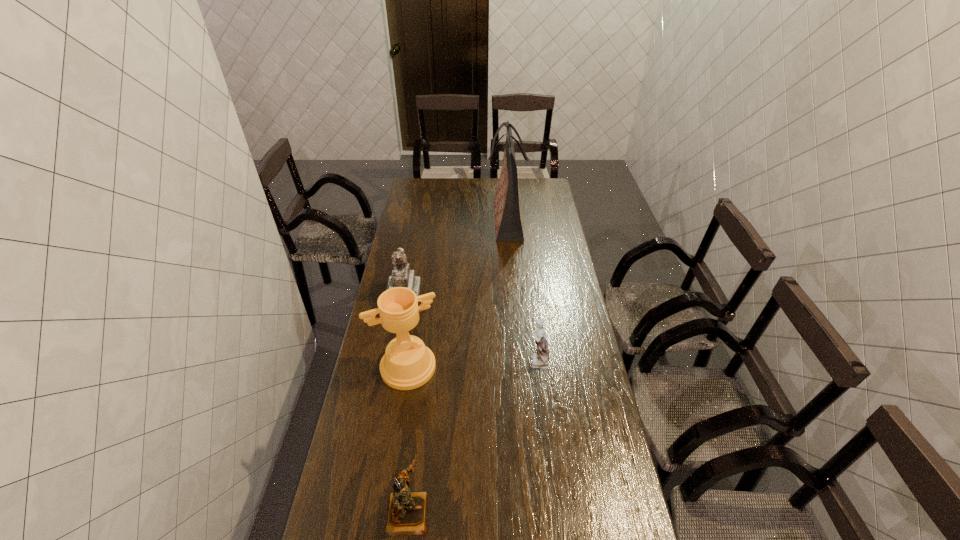
Identify the location of the farthest object. (508, 224).

Identify the location of the tallest object. Image resolution: width=960 pixels, height=540 pixels. (508, 224).

Identify the location of award. The width and height of the screenshot is (960, 540). (407, 364).

The image size is (960, 540). Find the location of `the farthest figurine`. the farthest figurine is located at coordinates (402, 276).

You are a GUI agent. You are given a task and a screenshot of the screen. Output one action in this format:
    pyautogui.click(x=<x>, y=<y>)
    Task: Click on the rightmost figurine
    The width and height of the screenshot is (960, 540).
    Given the screenshot: What is the action you would take?
    pyautogui.click(x=540, y=361)

Where is `the nearest object`? the nearest object is located at coordinates (406, 515).

The height and width of the screenshot is (540, 960). In order to click on free space located on the front-facing side of the farthest object in this screenshot , I will do `click(475, 220)`.

The image size is (960, 540). What are the coordinates of `free space located 0.340m on the front-facing side of the farthest object` in the screenshot? It's located at (419, 220).

Locate an element on the screen. Image resolution: width=960 pixels, height=540 pixels. free location located on the front-facing side of the farthest object is located at coordinates click(x=413, y=220).

Locate an element on the screen. This screenshot has width=960, height=540. vacant position located on the front of the fourth shortest object is located at coordinates (389, 493).